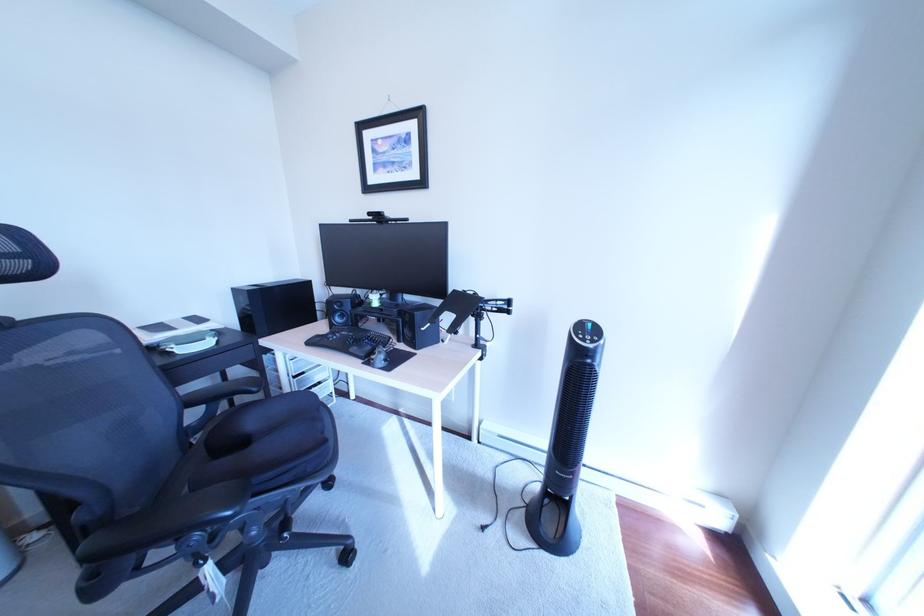
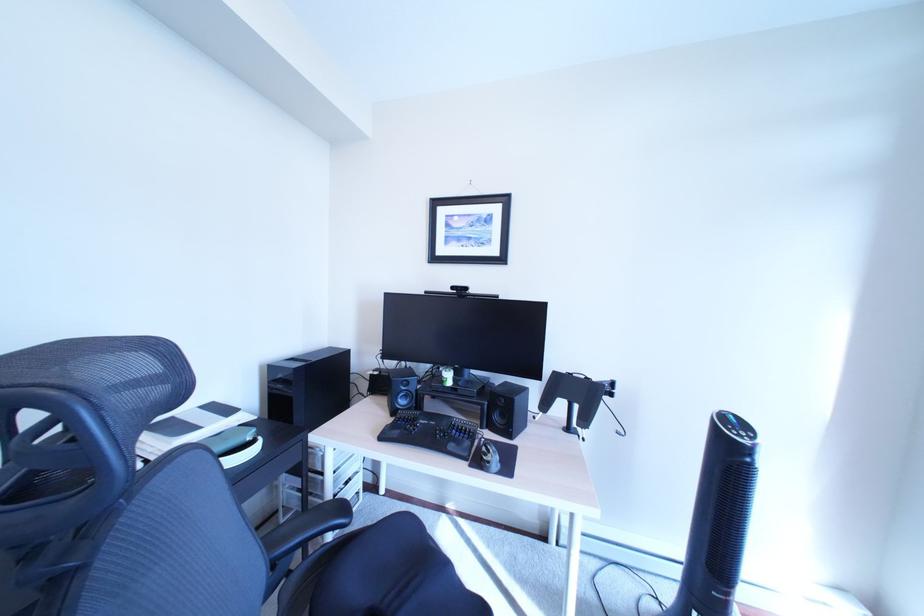
Question: The images are taken continuously from a first-person perspective. In which direction are you moving?

Choices:
 (A) Left
 (B) Right
 (C) Forward
 (D) Backward

Answer: (A)